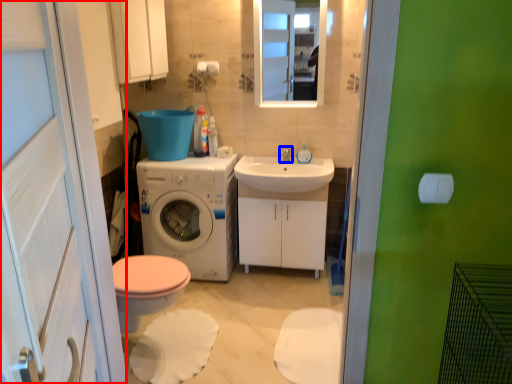
Question: Which point is closer to the camera, screen door (highlighted by a red box) or tap (highlighted by a blue box)?

Choices:
 (A) screen door
 (B) tap

Answer: (A)